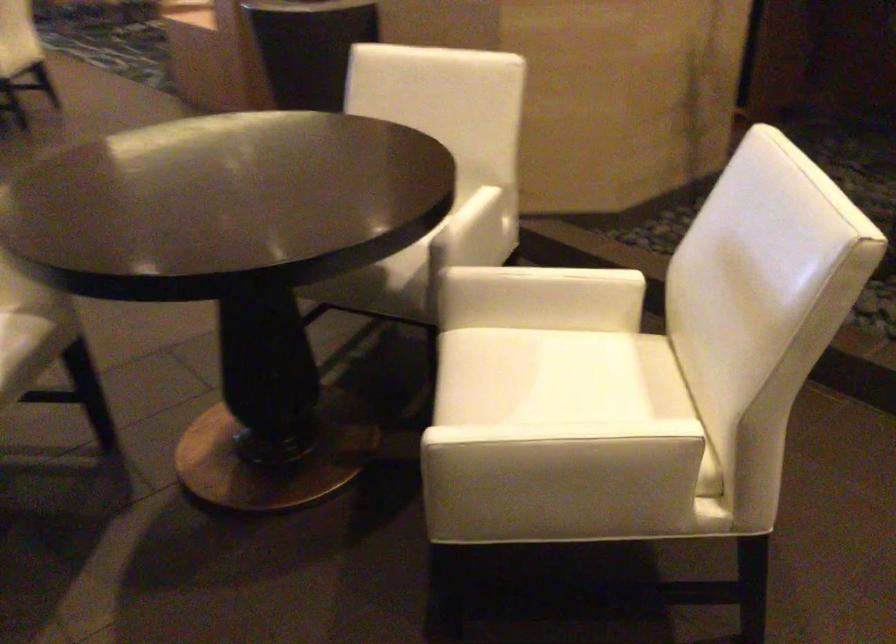
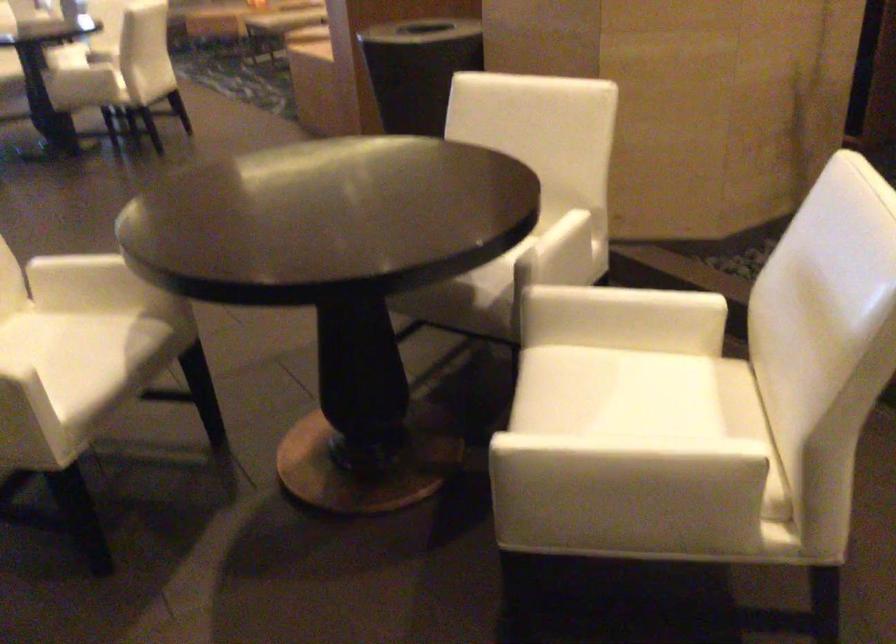
In the second image, find the point that corresponds to pixel 564 375 in the first image.

(640, 393)